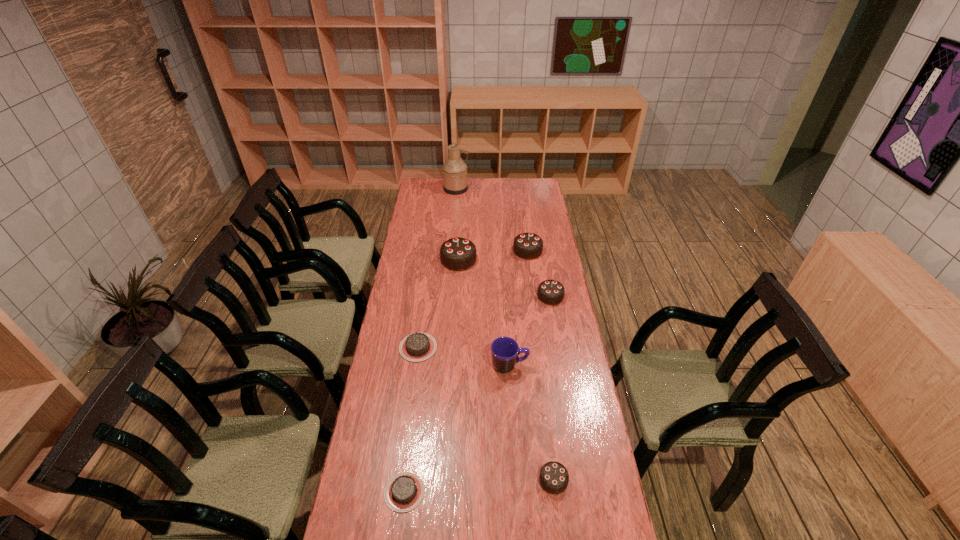
Locate an element on the screen. the second shortest chocolate cake is located at coordinates (416, 347).

At what (x,y) coordinates should I click in order to perform the action: click on the seventh tallest object. Please return your answer as a coordinate pair (x, y). This screenshot has height=540, width=960. Looking at the image, I should click on (416, 347).

This screenshot has width=960, height=540. I want to click on the shortest object, so click(x=404, y=491).

Find the location of a particular element. The width and height of the screenshot is (960, 540). the nearer brown chocolate cake is located at coordinates (404, 491).

The image size is (960, 540). Find the location of `vacant point located on the front of the pitcher`. vacant point located on the front of the pitcher is located at coordinates (453, 231).

Where is `vacant space located 0.300m on the right of the tallest chocolate cake`? vacant space located 0.300m on the right of the tallest chocolate cake is located at coordinates (538, 260).

Locate an element on the screen. vacant space located 0.090m on the back of the fifth shortest chocolate cake is located at coordinates (525, 232).

You are a GUI agent. You are given a task and a screenshot of the screen. Output one action in this format:
    pyautogui.click(x=<x>, y=<y>)
    Task: Click on the free spot located with the handle on the side of the mug
    
    Given the screenshot: What is the action you would take?
    pyautogui.click(x=557, y=366)

Identify the location of blank area located on the left of the fourth shortest object. [460, 296].

Identify the location of vacant space situated 0.060m on the back of the smallest chocolate chocolate cake. The height and width of the screenshot is (540, 960). (549, 448).